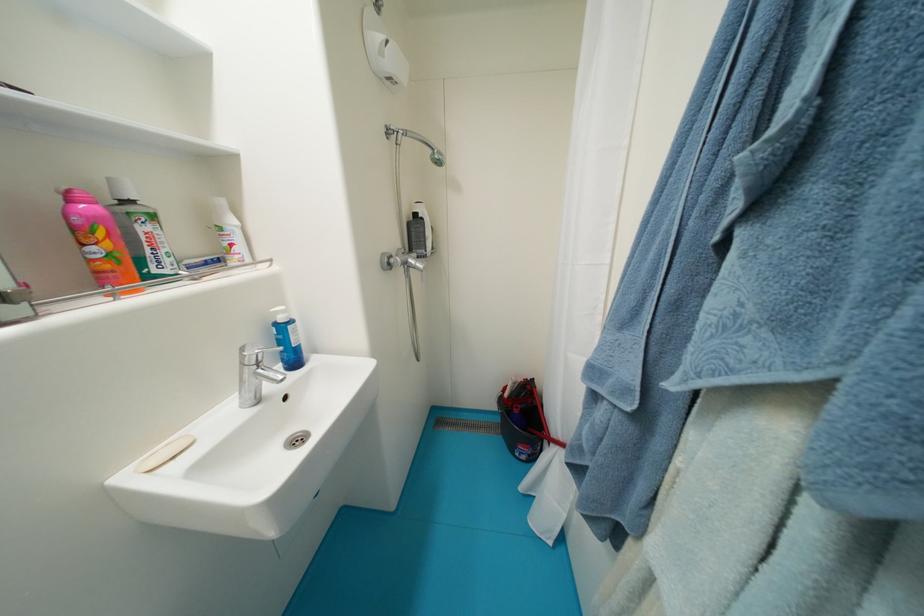
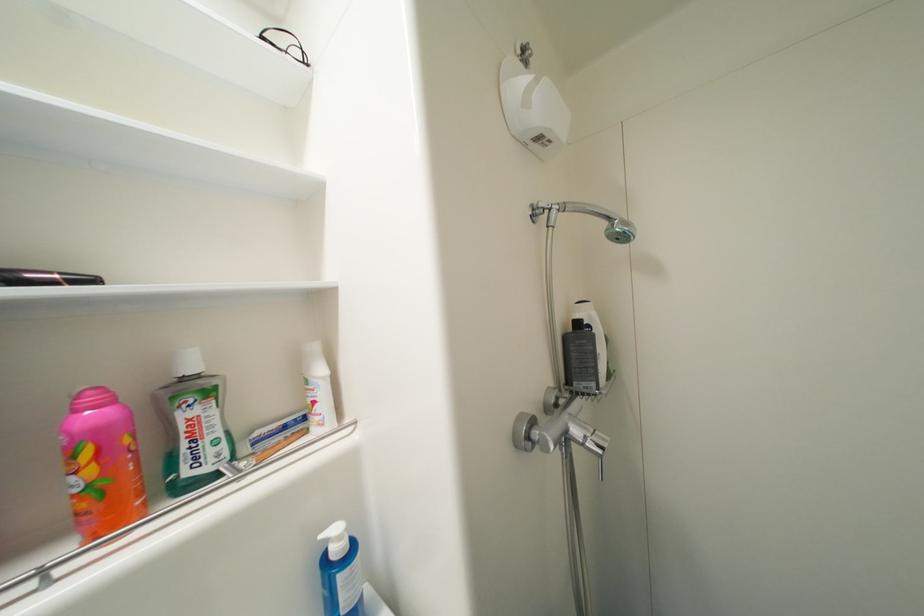
Question: The camera is either moving clockwise (left) or counter-clockwise (right) around the object. The first image is from the beginning of the video and the second image is from the end. Is the camera moving left or right when shooting the video?

Choices:
 (A) Left
 (B) Right

Answer: (B)